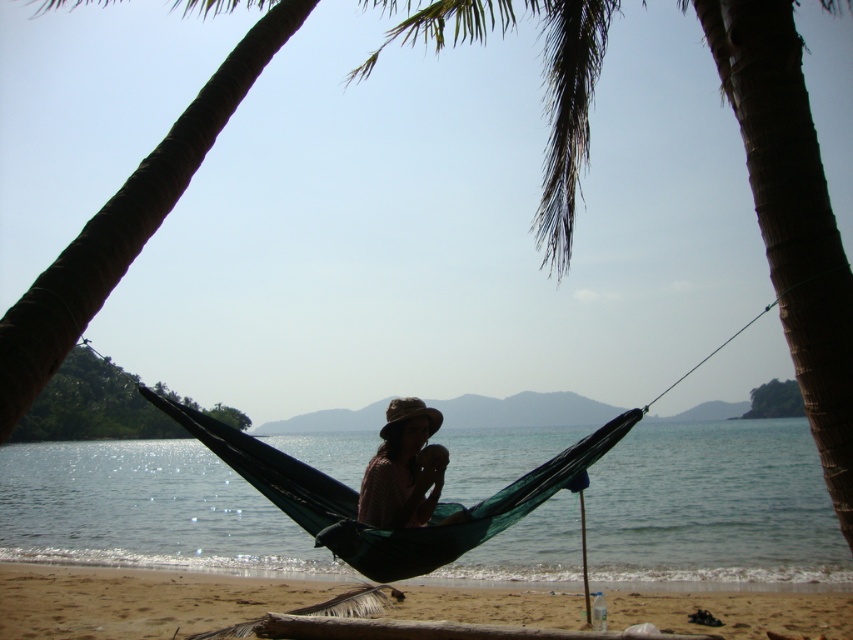
You are standing at the edge of the hammock and want to walk directly to the sandy beach at lower center. What direction should you move in?

Since the sandy beach at lower center is located at point coordinates of 0.939 on the x axis and 0.164 on the y axis, you should move forward towards the lower center direction to reach it.